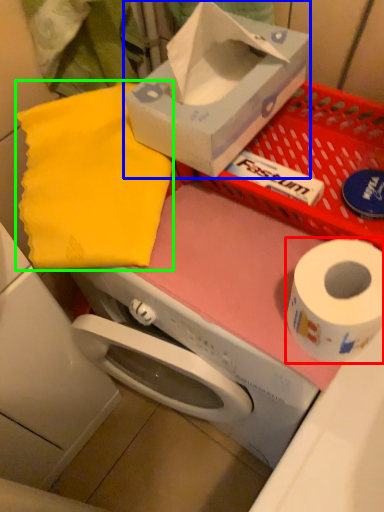
Question: Estimate the real-world distances between objects in this image. Which object is farther from toilet paper (highlighted by a red box), box (highlighted by a blue box) or cloth (highlighted by a green box)?

Choices:
 (A) box
 (B) cloth

Answer: (B)